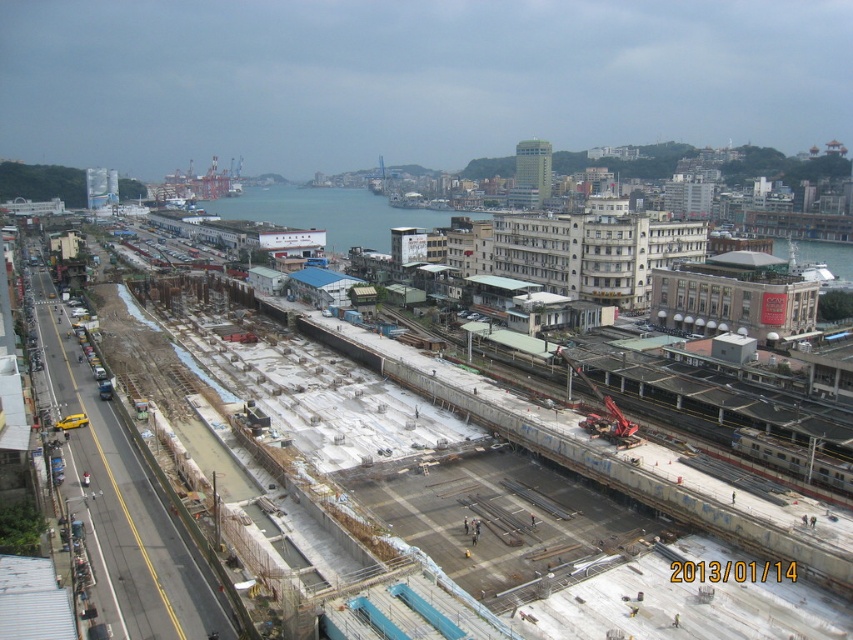
Can you confirm if concrete at center is positioned to the right of blue water at center?

Yes, concrete at center is to the right of blue water at center.

Can you confirm if concrete at center is bigger than blue water at center?

No, concrete at center is not bigger than blue water at center.

Who is more distant from viewer, [704,525] or [399,212]?

The point [399,212] is more distant.

Identify the location of concrete at center. The width and height of the screenshot is (853, 640). (438, 419).